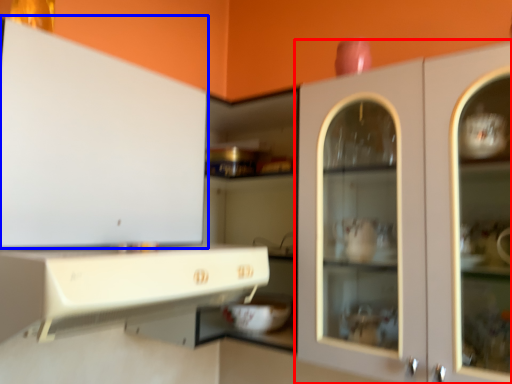
Question: Which object appears farthest to the camera in this image, cabinetry (highlighted by a red box) or cabinetry (highlighted by a blue box)?

Choices:
 (A) cabinetry
 (B) cabinetry

Answer: (A)